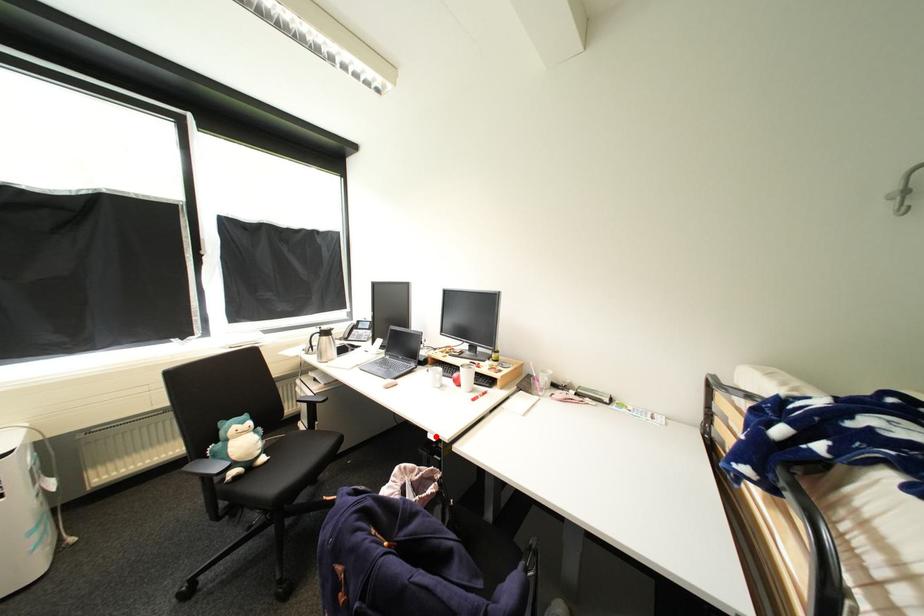
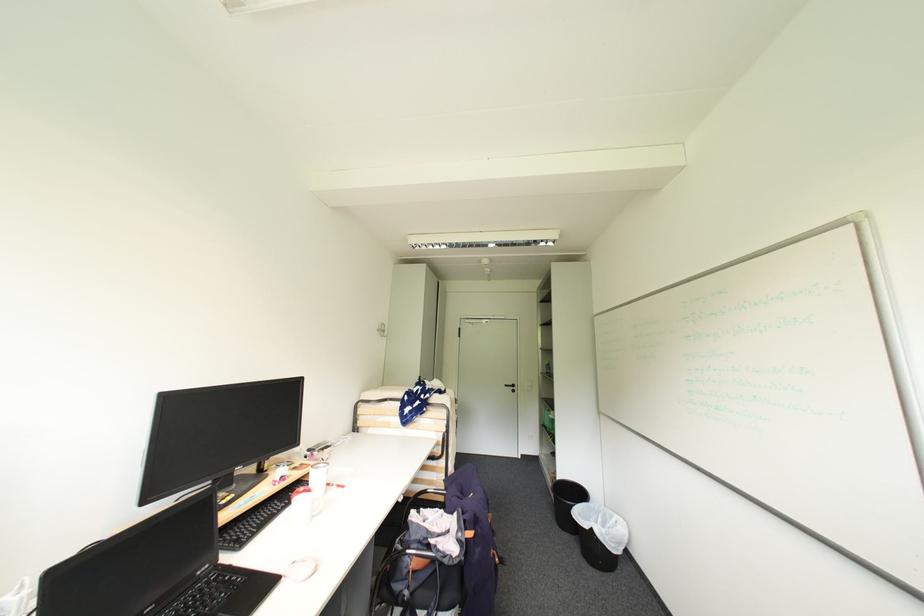
Find the pixel in the second image that matches the highlighted location in the first image.

(407, 501)